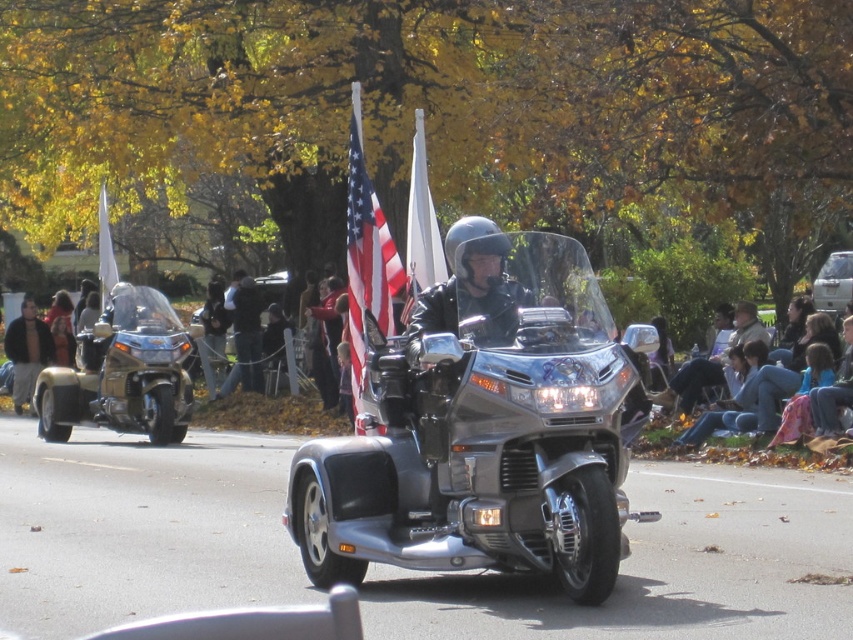
Who is positioned more to the left, american flag at center or white fabric flag at upper left?

From the viewer's perspective, white fabric flag at upper left appears more on the left side.

Does american flag at center come behind white fabric flag at upper left?

No, american flag at center is in front of white fabric flag at upper left.

What do you see at coordinates (366, 259) in the screenshot? Image resolution: width=853 pixels, height=640 pixels. I see `american flag at center` at bounding box center [366, 259].

Identify the location of american flag at center. (366, 259).

Does point (350, 300) come behind point (415, 170)?

No.

Is point (358, 324) in front of point (427, 276)?

No, it is not.

Locate an element on the screen. The width and height of the screenshot is (853, 640). american flag at center is located at coordinates (366, 259).

Is white fabric flag at center bigger than white fabric flag at upper left?

No.

Does white fabric flag at center come in front of white fabric flag at upper left?

Yes, white fabric flag at center is closer to the viewer.

Is point (421, 129) farther from camera compared to point (105, 252)?

No, it is not.

Find the location of a particular element. white fabric flag at center is located at coordinates (421, 227).